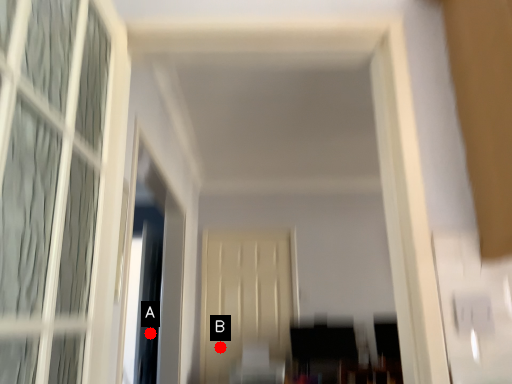
Question: Two points are circled on the image, labeled by A and B beside each circle. Which point is closer to the camera taking this photo?

Choices:
 (A) A is closer
 (B) B is closer

Answer: (A)